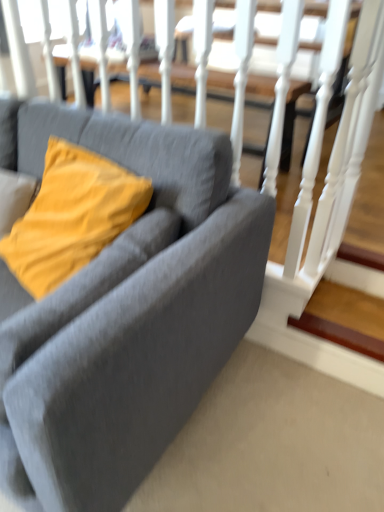
What do you see at coordinates (339, 334) in the screenshot? I see `wooden at lower right` at bounding box center [339, 334].

You are a GUI agent. You are given a task and a screenshot of the screen. Output one action in this format:
    pyautogui.click(x=<x>, y=<y>)
    Task: Click on the matte yellow pillow at left
    
    Given the screenshot: What is the action you would take?
    pyautogui.click(x=72, y=216)

You are a GUI agent. You are given a task and a screenshot of the screen. Output one action in this format:
    pyautogui.click(x=<x>, y=<y>)
    Task: Click on the studio couch that appears above the wooden at lower right (from the image's perspective)
    The image size is (384, 512).
    Given the screenshot: What is the action you would take?
    pyautogui.click(x=130, y=310)

Is wooden at lower right facing away from matte gray couch at center?

That's not correct — wooden at lower right is not looking away from matte gray couch at center.

Looking at this image, would you say wooden at lower right is inside or outside matte gray couch at center?

wooden at lower right is not enclosed by matte gray couch at center.

From a real-world perspective, who is located lower, matte gray couch at center or matte yellow pillow at left?

matte gray couch at center.

Consider the image. Is matte gray couch at center to the right of matte yellow pillow at left from the viewer's perspective?

A: In fact, matte gray couch at center is to the left of matte yellow pillow at left.

Is point (204, 333) in front of point (74, 195)?

Yes, it is in front of point (74, 195).

How much distance is there between matte gray couch at center and matte yellow pillow at left?

matte gray couch at center and matte yellow pillow at left are 9.54 inches apart from each other.

Can you confirm if matte yellow pillow at left is smaller than wooden at lower right?

Incorrect, matte yellow pillow at left is not smaller in size than wooden at lower right.

Are matte yellow pillow at left and wooden at lower right located far from each other?

matte yellow pillow at left is near wooden at lower right, not far away.

From the picture: Which is closer to the camera, [126,178] or [314,330]?

Clearly, point [126,178] is closer to the camera than point [314,330].

Between matte yellow pillow at left and wooden at lower right, which one is positioned in front?

matte yellow pillow at left is in front.

From a real-world perspective, is wooden at lower right on top of matte yellow pillow at left?

No, from a real-world perspective, wooden at lower right is not over matte yellow pillow at left

Is wooden at lower right outside of matte yellow pillow at left?

Absolutely, wooden at lower right is external to matte yellow pillow at left.

In terms of height, does wooden at lower right look taller or shorter compared to matte yellow pillow at left?

In the image, wooden at lower right appears to be shorter than matte yellow pillow at left.

Between wooden at lower right and matte yellow pillow at left, which one appears on the right side from the viewer's perspective?

From the viewer's perspective, wooden at lower right appears more on the right side.

From the image's perspective, is matte yellow pillow at left beneath matte gray couch at center?

Actually, matte yellow pillow at left appears above matte gray couch at center in the image.

Find the location of a particular element. This screenshot has height=512, width=384. studio couch below the matte yellow pillow at left (from a real-world perspective) is located at coordinates (130, 310).

Is matte yellow pillow at left positioned in front of matte gray couch at center?

No, it is not.

Can you confirm if matte yellow pillow at left is smaller than matte gray couch at center?

Yes, matte yellow pillow at left is smaller than matte gray couch at center.

From the image's perspective, does matte gray couch at center appear higher than wooden at lower right?

Correct, matte gray couch at center appears higher than wooden at lower right in the image.

Is matte gray couch at center positioned beyond the bounds of wooden at lower right?

Yes.

Is matte gray couch at center positioned with its back to wooden at lower right?

matte gray couch at center does not have its back to wooden at lower right.

How different are the orientations of matte gray couch at center and wooden at lower right in degrees?

The facing directions of matte gray couch at center and wooden at lower right are 0.398 degrees apart.

At what (x,y) coordinates should I click in order to perform the action: click on stairwell behind the matte gray couch at center. Please return your answer as a coordinate pair (x, y). The height and width of the screenshot is (512, 384). Looking at the image, I should click on (339, 334).

The width and height of the screenshot is (384, 512). I want to click on studio couch lying on the left of matte yellow pillow at left, so click(130, 310).

From the image, which object appears to be nearer to wooden at lower right, matte yellow pillow at left or matte gray couch at center?

matte gray couch at center.

Estimate the real-world distances between objects in this image. Which object is closer to matte gray couch at center, matte yellow pillow at left or wooden at lower right?

matte yellow pillow at left.

Estimate the real-world distances between objects in this image. Which object is further from wooden at lower right, matte gray couch at center or matte yellow pillow at left?

matte yellow pillow at left lies further to wooden at lower right than the other object.

From the image, which object appears to be nearer to matte gray couch at center, wooden at lower right or matte yellow pillow at left?

The object closer to matte gray couch at center is matte yellow pillow at left.

When comparing their distances from matte yellow pillow at left, does matte gray couch at center or wooden at lower right seem further?

wooden at lower right lies further to matte yellow pillow at left than the other object.

Estimate the real-world distances between objects in this image. Which object is closer to matte yellow pillow at left, wooden at lower right or matte gray couch at center?

The object closer to matte yellow pillow at left is matte gray couch at center.

In order to click on pillow located between matte gray couch at center and wooden at lower right in the left-right direction in this screenshot , I will do `click(72, 216)`.